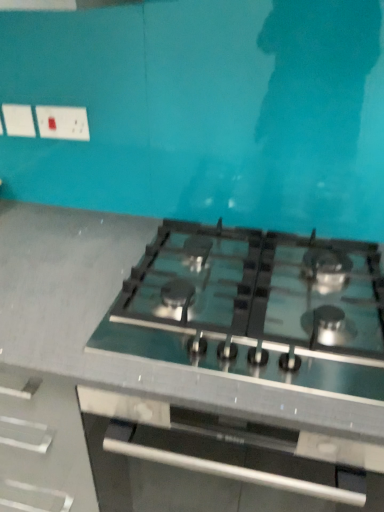
Question: Is green glass stove at center positioned far away from satin black gas stove at center?

Choices:
 (A) no
 (B) yes

Answer: (A)

Question: From a real-world perspective, is green glass stove at center located beneath satin black gas stove at center?

Choices:
 (A) no
 (B) yes

Answer: (B)

Question: Can you confirm if green glass stove at center is bigger than satin black gas stove at center?

Choices:
 (A) yes
 (B) no

Answer: (A)

Question: Does green glass stove at center have a lesser height compared to satin black gas stove at center?

Choices:
 (A) yes
 (B) no

Answer: (B)

Question: From the image's perspective, is green glass stove at center over satin black gas stove at center?

Choices:
 (A) no
 (B) yes

Answer: (A)

Question: Is green glass stove at center outside satin black gas stove at center?

Choices:
 (A) no
 (B) yes

Answer: (B)

Question: Could you tell me if green glass stove at center is turned towards white plastic socket at upper left?

Choices:
 (A) yes
 (B) no

Answer: (B)

Question: Is green glass stove at center to the left of white plastic socket at upper left from the viewer's perspective?

Choices:
 (A) no
 (B) yes

Answer: (A)

Question: Is white plastic socket at upper left surrounded by green glass stove at center?

Choices:
 (A) no
 (B) yes

Answer: (A)

Question: From the image's perspective, is green glass stove at center located beneath white plastic socket at upper left?

Choices:
 (A) yes
 (B) no

Answer: (A)

Question: From a real-world perspective, is green glass stove at center under white plastic socket at upper left?

Choices:
 (A) yes
 (B) no

Answer: (A)

Question: Is green glass stove at center looking in the opposite direction of white plastic socket at upper left?

Choices:
 (A) yes
 (B) no

Answer: (B)

Question: From a real-world perspective, is satin black gas stove at center positioned over white plastic socket at upper left based on gravity?

Choices:
 (A) no
 (B) yes

Answer: (A)